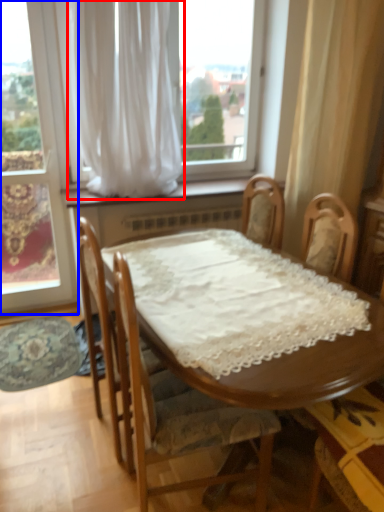
Question: Which object is closer to the camera taking this photo, curtain (highlighted by a red box) or window (highlighted by a blue box)?

Choices:
 (A) curtain
 (B) window

Answer: (A)